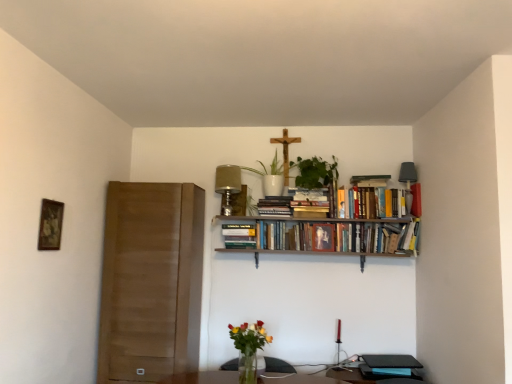
Question: From the image's perspective, is green leafy plant at upper center, the 1th plant positioned from the right, located above hardcover books at upper center, positioned as the fourth book in left-to-right order?

Choices:
 (A) no
 (B) yes

Answer: (B)

Question: Can you confirm if green leafy plant at upper center, the 1th plant positioned from the right, is wider than hardcover books at upper center, the 2th book in the right-to-left sequence?

Choices:
 (A) no
 (B) yes

Answer: (B)

Question: Is green leafy plant at upper center, the 1th plant positioned from the right, positioned in front of hardcover books at upper center, the 2th book in the right-to-left sequence?

Choices:
 (A) yes
 (B) no

Answer: (A)

Question: Can hardcover books at upper center, the 2th book in the right-to-left sequence, be found inside green leafy plant at upper center, which appears as the second plant when viewed from the left?

Choices:
 (A) no
 (B) yes

Answer: (A)

Question: Is green leafy plant at upper center, which appears as the second plant when viewed from the left, placed right next to hardcover books at upper center, positioned as the fourth book in left-to-right order?

Choices:
 (A) yes
 (B) no

Answer: (B)

Question: Is green leafy plant at upper center, the 1th plant positioned from the right, far away from hardcover books at upper center, positioned as the fourth book in left-to-right order?

Choices:
 (A) yes
 (B) no

Answer: (B)

Question: Does translucent glass vase at lower center have a greater width compared to wooden picture frame at left?

Choices:
 (A) yes
 (B) no

Answer: (A)

Question: Is translucent glass vase at lower center further to the viewer compared to wooden picture frame at left?

Choices:
 (A) yes
 (B) no

Answer: (A)

Question: Does translucent glass vase at lower center turn towards wooden picture frame at left?

Choices:
 (A) yes
 (B) no

Answer: (B)

Question: Does translucent glass vase at lower center lie in front of wooden picture frame at left?

Choices:
 (A) yes
 (B) no

Answer: (B)

Question: Can you confirm if translucent glass vase at lower center is positioned to the left of wooden picture frame at left?

Choices:
 (A) no
 (B) yes

Answer: (A)

Question: Is wooden picture frame at left located within translucent glass vase at lower center?

Choices:
 (A) yes
 (B) no

Answer: (B)

Question: Is hardcover book at upper right, the 1th book when ordered from right to left, outside hardcover books at upper center, positioned as the fourth book in left-to-right order?

Choices:
 (A) yes
 (B) no

Answer: (A)